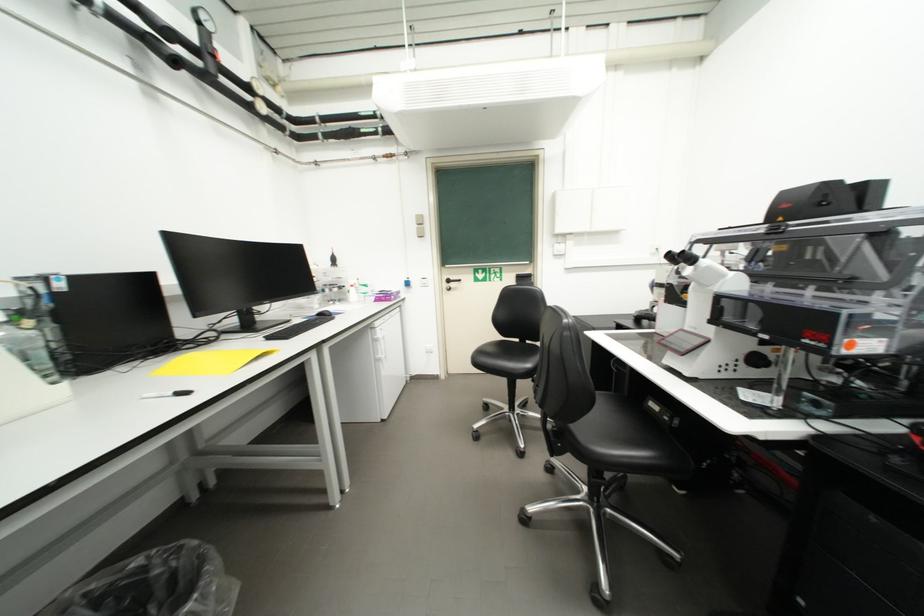
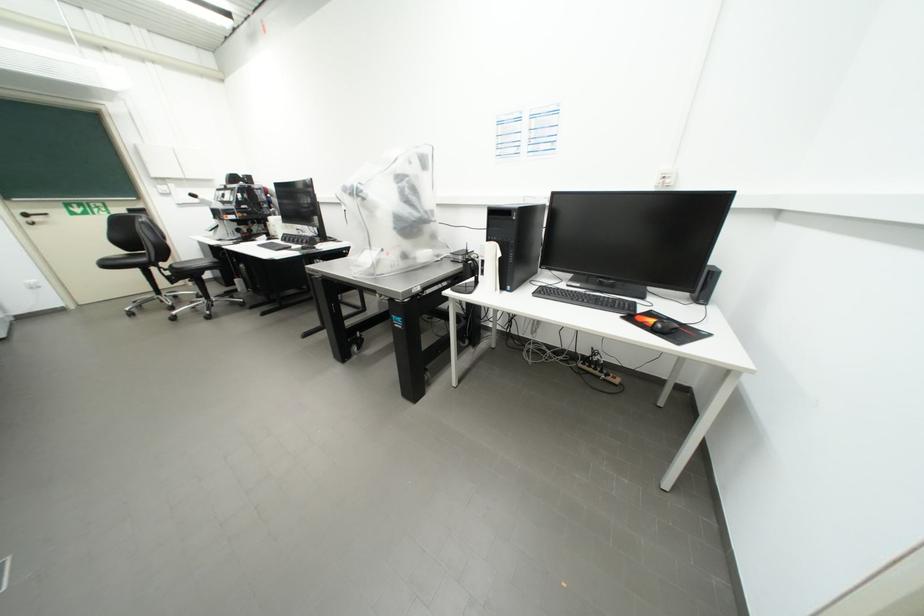
In the second image, find the point that corresponds to pixel 459 286 in the first image.

(43, 220)